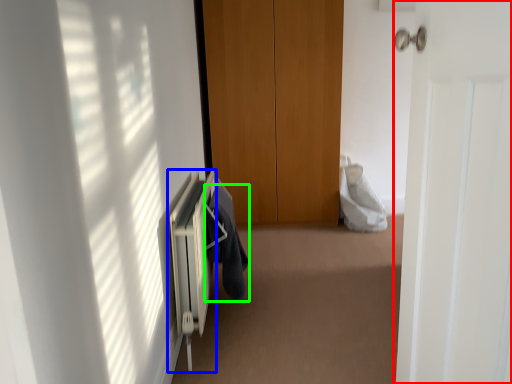
Question: Considering the real-world distances, which object is closest to door (highlighted by a red box)? radiator (highlighted by a blue box) or garment (highlighted by a green box).

Choices:
 (A) radiator
 (B) garment

Answer: (A)